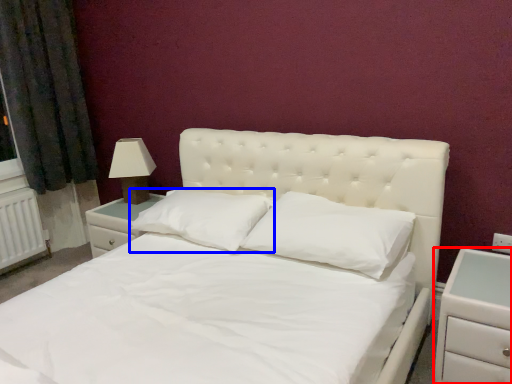
Question: Among these objects, which one is farthest to the camera, nightstand (highlighted by a red box) or pillow (highlighted by a blue box)?

Choices:
 (A) nightstand
 (B) pillow

Answer: (B)